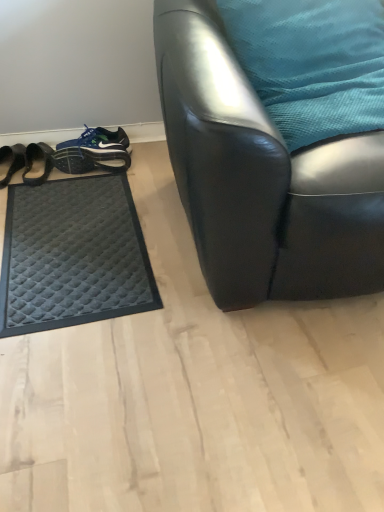
Question: Does point (306, 95) appear closer or farther from the camera than point (263, 144)?

Choices:
 (A) closer
 (B) farther

Answer: (B)

Question: From their relative heights in the image, would you say teal fabric pillow at upper right is taller or shorter than black leather chair at center?

Choices:
 (A) tall
 (B) short

Answer: (B)

Question: Estimate the real-world distances between objects in this image. Which object is closer to the black leather chair at center?

Choices:
 (A) black quilted mat at left, which is the 1th footwear from left to right
 (B) blue fabric shoe at lower left, the second footwear in the left-to-right sequence
 (C) teal fabric pillow at upper right
 (D) black quilted mat at lower left

Answer: (C)

Question: Based on their relative distances, which object is farther from the blue fabric shoe at lower left, the second footwear in the left-to-right sequence?

Choices:
 (A) black quilted mat at lower left
 (B) black quilted mat at left, which is the 1th footwear from left to right
 (C) black leather chair at center
 (D) teal fabric pillow at upper right

Answer: (C)